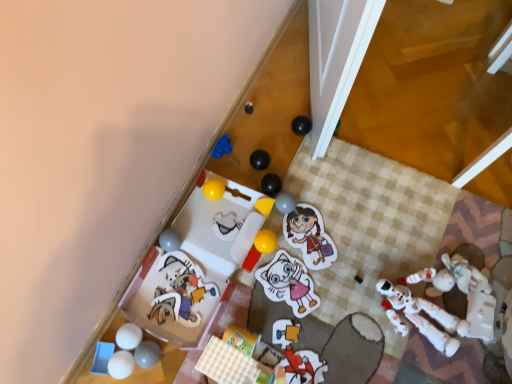
Question: Is blue plastic tray at lower left, the fifteenth toy from the right, not inside yellow matte block at upper center, placed as the 11th toy when sorted from left to right?

Choices:
 (A) no
 (B) yes

Answer: (B)

Question: Is blue plastic tray at lower left, the fifteenth toy from the right, oriented away from yellow matte block at upper center, placed as the 11th toy when sorted from left to right?

Choices:
 (A) no
 (B) yes

Answer: (A)

Question: Could you tell me if blue plastic tray at lower left, the fifteenth toy from the right, is turned towards yellow matte block at upper center, which is the fifth toy in right-to-left order?

Choices:
 (A) yes
 (B) no

Answer: (B)

Question: Is blue plastic tray at lower left, placed as the first toy when sorted from left to right, with yellow matte block at upper center, placed as the 11th toy when sorted from left to right?

Choices:
 (A) no
 (B) yes

Answer: (A)

Question: From a real-world perspective, is blue plastic tray at lower left, the fifteenth toy from the right, on top of yellow matte block at upper center, which is the fifth toy in right-to-left order?

Choices:
 (A) yes
 (B) no

Answer: (B)

Question: In terms of height, does matte plastic toy at center, arranged as the eighth toy when viewed from the right, look taller or shorter compared to matte gray ball at lower left, acting as the fourth toy starting from the left?

Choices:
 (A) tall
 (B) short

Answer: (B)

Question: Which is correct: matte plastic toy at center, the 8th toy when ordered from left to right, is inside matte gray ball at lower left, acting as the fourth toy starting from the left, or outside of it?

Choices:
 (A) inside
 (B) outside

Answer: (B)

Question: Would you say matte plastic toy at center, the 8th toy when ordered from left to right, is to the left or to the right of matte gray ball at lower left, acting as the fourth toy starting from the left, in the picture?

Choices:
 (A) right
 (B) left

Answer: (A)

Question: In terms of width, does matte plastic toy at center, arranged as the eighth toy when viewed from the right, look wider or thinner when compared to matte gray ball at lower left, acting as the fourth toy starting from the left?

Choices:
 (A) wide
 (B) thin

Answer: (B)

Question: Relative to white plastic toy at lower right, the fifteenth toy viewed from the left, is blue plastic tray at lower left, the fifteenth toy from the right, in front or behind?

Choices:
 (A) front
 (B) behind

Answer: (B)

Question: From a real-world perspective, is blue plastic tray at lower left, the fifteenth toy from the right, above or below white plastic toy at lower right, the fifteenth toy viewed from the left?

Choices:
 (A) below
 (B) above

Answer: (A)

Question: From their relative heights in the image, would you say blue plastic tray at lower left, the fifteenth toy from the right, is taller or shorter than white plastic toy at lower right, marked as the first toy in a right-to-left arrangement?

Choices:
 (A) short
 (B) tall

Answer: (A)

Question: In terms of width, does blue plastic tray at lower left, placed as the first toy when sorted from left to right, look wider or thinner when compared to white plastic toy at lower right, marked as the first toy in a right-to-left arrangement?

Choices:
 (A) wide
 (B) thin

Answer: (B)

Question: Considering the positions of point (136, 349) and point (212, 190), is point (136, 349) closer or farther from the camera than point (212, 190)?

Choices:
 (A) closer
 (B) farther

Answer: (A)

Question: Is matte gray ball at lower left, acting as the fourth toy starting from the left, in front of or behind yellow rubber ball at center, placed as the 6th toy when sorted from left to right, in the image?

Choices:
 (A) behind
 (B) front

Answer: (B)